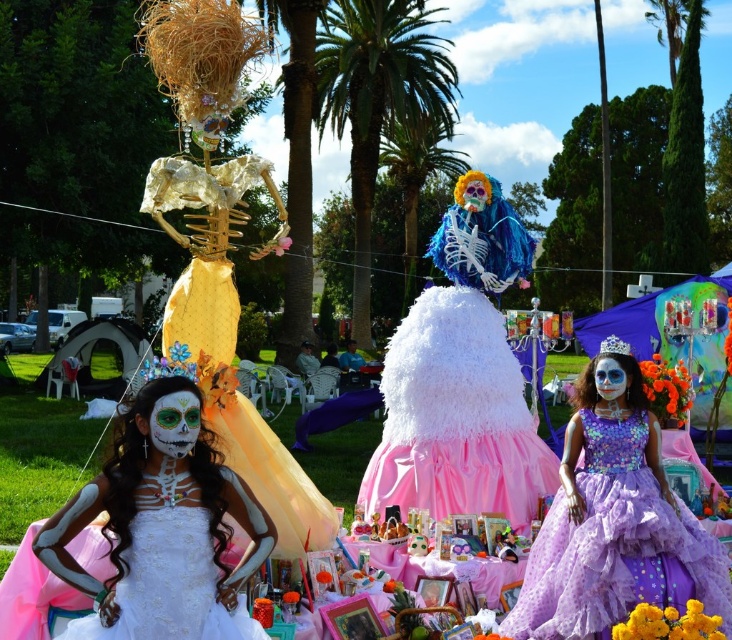
Question: Is white matte dress at center wider than lavender tulle dress at right?

Choices:
 (A) yes
 (B) no

Answer: (B)

Question: Which point is farther from the camera taking this photo?

Choices:
 (A) (675, 592)
 (B) (212, 636)

Answer: (A)

Question: Does white matte dress at center appear over lavender tulle dress at right?

Choices:
 (A) no
 (B) yes

Answer: (B)

Question: Does white matte dress at center have a lesser width compared to lavender tulle dress at right?

Choices:
 (A) no
 (B) yes

Answer: (B)

Question: Which of the following is the closest to the observer?

Choices:
 (A) (623, 362)
 (B) (198, 554)

Answer: (B)

Question: Which of the following is the closest to the observer?

Choices:
 (A) white matte dress at center
 (B) lavender tulle dress at right

Answer: (A)